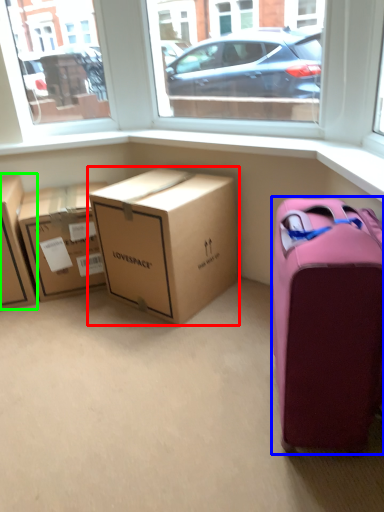
Question: Which object is the closest to the box (highlighted by a red box)? Choose among these: suitcase (highlighted by a blue box) or box (highlighted by a green box).

Choices:
 (A) suitcase
 (B) box

Answer: (B)